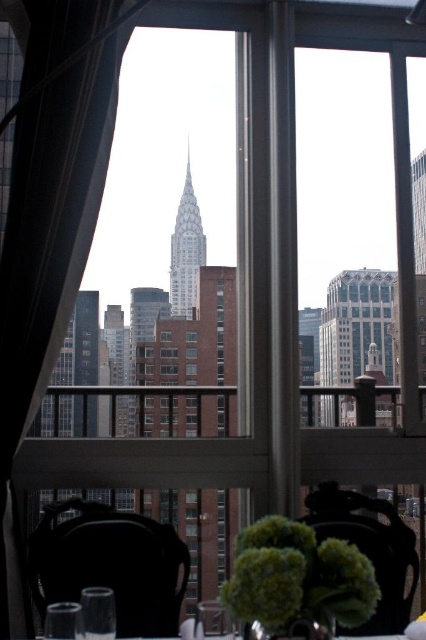
Question: Does clear glass wine glass at lower center come behind clear glass table at center?

Choices:
 (A) no
 (B) yes

Answer: (A)

Question: From the image, what is the correct spatial relationship of clear glass wine glass at lower left in relation to clear glass table at center?

Choices:
 (A) below
 (B) above

Answer: (B)

Question: Which object is the closest to the clear glass wine glass at lower left?

Choices:
 (A) clear glass wine glass at lower center
 (B) clear glass table at center
 (C) black leather chair at lower left

Answer: (C)

Question: Can you confirm if clear glass wine glass at lower left is positioned below clear glass table at center?

Choices:
 (A) no
 (B) yes

Answer: (A)

Question: Which of these objects is positioned farthest from the satin white curtain at left?

Choices:
 (A) clear glass wine glass at lower left
 (B) black leather chair at lower left
 (C) clear glass wine glass at lower center
 (D) transparent glass at lower left

Answer: (C)

Question: Which point appears farthest from the camera in this image?

Choices:
 (A) (409, 627)
 (B) (94, 609)
 (C) (108, 49)
 (D) (158, 598)

Answer: (A)